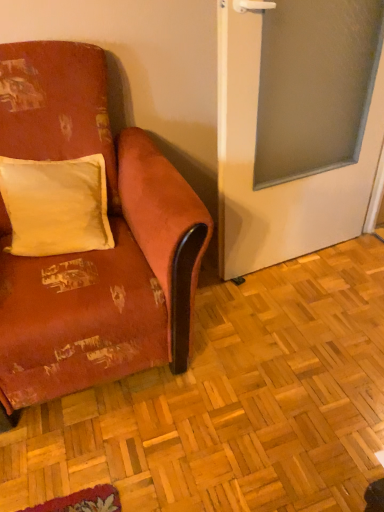
I want to click on vacant space underneath frosted glass screen door at right (from a real-world perspective), so click(x=304, y=262).